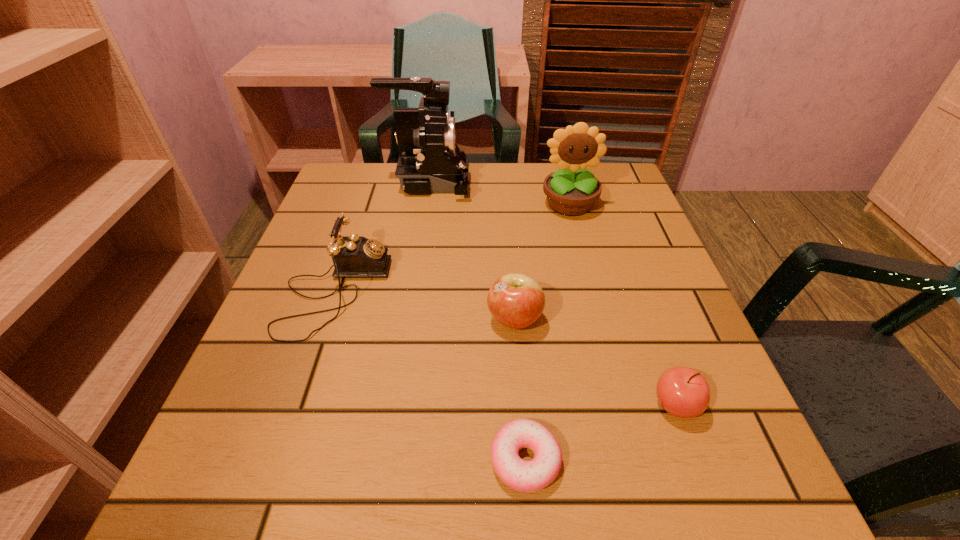
This screenshot has height=540, width=960. I want to click on blank space that satisfies the following two spatial constraints: 1. on the face of the second tallest object; 2. on the right side of the second nearest object, so click(621, 404).

Locate an element on the screen. The width and height of the screenshot is (960, 540). blank area in the image that satisfies the following two spatial constraints: 1. on the dial of the telephone; 2. on the left side of the farther apple is located at coordinates (325, 319).

Locate an element on the screen. free spot that satisfies the following two spatial constraints: 1. on the back side of the nearest object; 2. on the dial of the third tallest object is located at coordinates (513, 292).

Locate an element on the screen. free space that satisfies the following two spatial constraints: 1. on the back side of the farther apple; 2. on the lens mount of the camcorder is located at coordinates (504, 183).

Identify the location of vacant space that satisfies the following two spatial constraints: 1. on the dial of the fourth shortest object; 2. on the back side of the fifth farthest object. (296, 404).

I want to click on vacant point that satisfies the following two spatial constraints: 1. on the face of the sunflower; 2. on the right side of the second nearest object, so click(621, 404).

Locate an element on the screen. The image size is (960, 540). free space that satisfies the following two spatial constraints: 1. on the dial of the telephone; 2. on the back side of the second nearest object is located at coordinates (296, 404).

The image size is (960, 540). Find the location of `vacant space that satisfies the following two spatial constraints: 1. on the lens mount of the camcorder; 2. on the right side of the left apple`. vacant space that satisfies the following two spatial constraints: 1. on the lens mount of the camcorder; 2. on the right side of the left apple is located at coordinates (406, 319).

This screenshot has width=960, height=540. In order to click on vacant space that satisfies the following two spatial constraints: 1. on the face of the fifth shortest object; 2. on the dial of the telephone in this screenshot , I will do `click(592, 292)`.

The image size is (960, 540). Identify the location of free location that satisfies the following two spatial constraints: 1. on the lens mount of the tallest object; 2. on the back side of the nearest object. (383, 460).